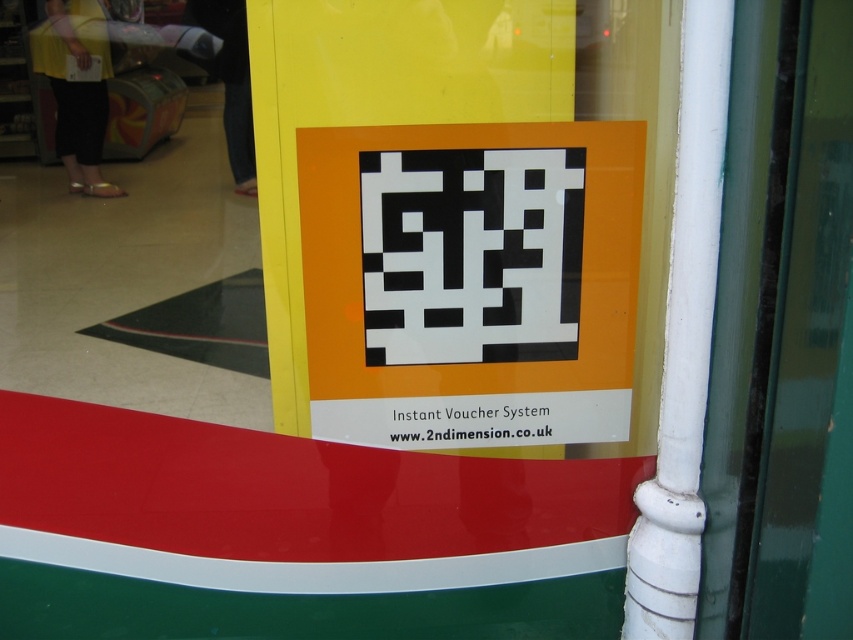
Is black paper qr code at center to the left of black pixelated qr code at center from the viewer's perspective?

In fact, black paper qr code at center is to the right of black pixelated qr code at center.

Is black paper qr code at center closer to the viewer compared to black pixelated qr code at center?

Yes, it is.

The height and width of the screenshot is (640, 853). What do you see at coordinates (469, 282) in the screenshot?
I see `black paper qr code at center` at bounding box center [469, 282].

Image resolution: width=853 pixels, height=640 pixels. I want to click on black paper qr code at center, so click(x=469, y=282).